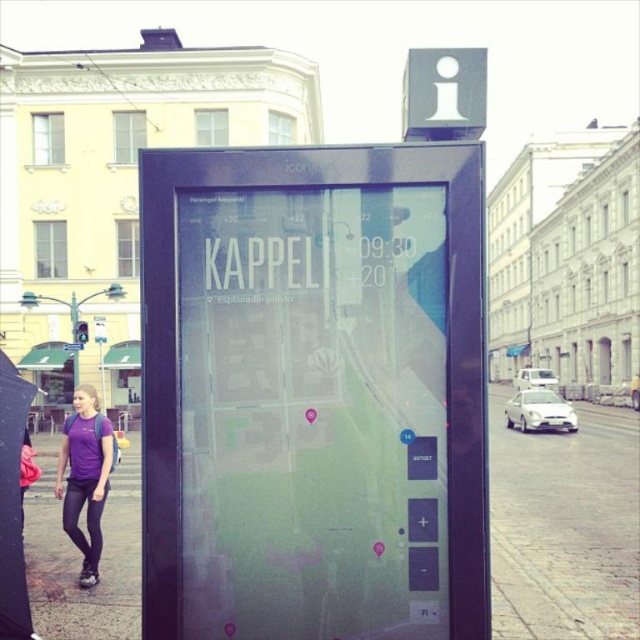
Question: Is matte glass pavement at lower left to the right of purple fabric shirt at lower left from the viewer's perspective?

Choices:
 (A) yes
 (B) no

Answer: (A)

Question: Does matte glass pavement at lower left appear under brick pavement at lower right?

Choices:
 (A) no
 (B) yes

Answer: (B)

Question: Among these objects, which one is nearest to the camera?

Choices:
 (A) brick pavement at lower right
 (B) purple fabric shirt at lower left

Answer: (A)

Question: Which of the following is the farthest from the observer?

Choices:
 (A) (86, 598)
 (B) (627, 420)
 (C) (113, 442)

Answer: (B)

Question: Which point is closer to the camera?

Choices:
 (A) brick pavement at lower right
 (B) purple fabric shirt at lower left

Answer: (A)

Question: Is matte glass pavement at lower left smaller than brick pavement at lower right?

Choices:
 (A) no
 (B) yes

Answer: (A)